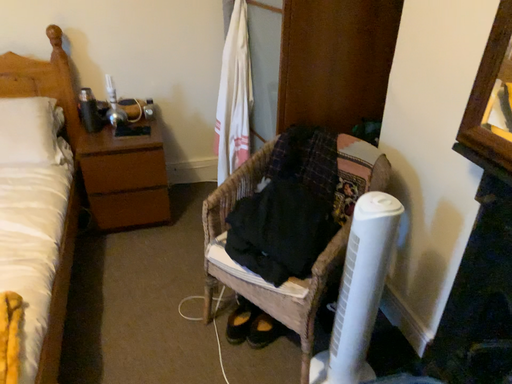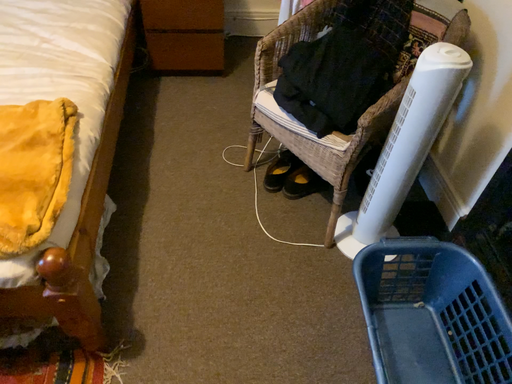
Question: How did the camera likely rotate when shooting the video?

Choices:
 (A) rotated upward
 (B) rotated downward

Answer: (B)